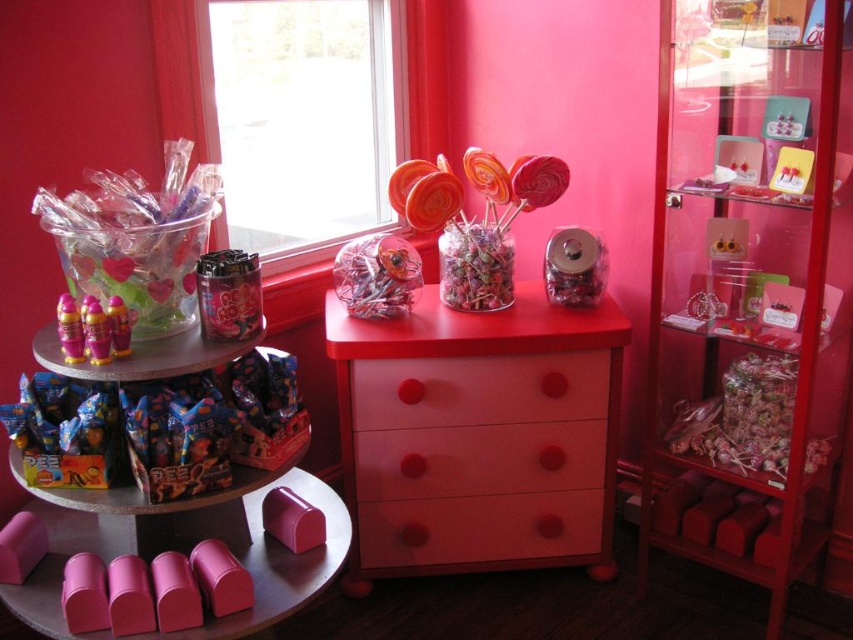
Question: Which of the following is the closest to the observer?

Choices:
 (A) pink matte table at lower center
 (B) shiny plastic bottles at left

Answer: (A)

Question: Which object is closer to the camera taking this photo?

Choices:
 (A) metallic pink toy at center
 (B) shiny plastic bottles at left
 (C) shiny plastic lollipops at center

Answer: (B)

Question: Considering the relative positions of matte pink dresser at center and shiny metallic bottles at left in the image provided, where is matte pink dresser at center located with respect to shiny metallic bottles at left?

Choices:
 (A) below
 (B) above

Answer: (A)

Question: Is transparent plastic window at upper center thinner than matte plastic drawer at center?

Choices:
 (A) yes
 (B) no

Answer: (A)

Question: Is translucent plastic jar at center wider than shiny metallic bottles at left?

Choices:
 (A) yes
 (B) no

Answer: (A)

Question: Which point is closer to the camera taking this photo?

Choices:
 (A) (67, 358)
 (B) (409, 161)
 (C) (79, 330)
 (D) (105, 316)

Answer: (D)